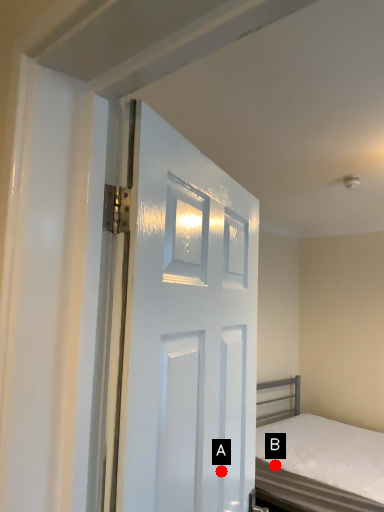
Question: Two points are circled on the image, labeled by A and B beside each circle. Which of the following is the closest to the observer?

Choices:
 (A) A is closer
 (B) B is closer

Answer: (A)